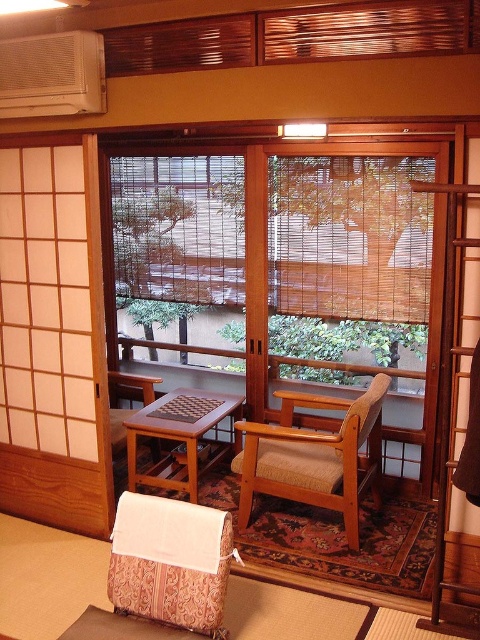
Question: Can you confirm if white plastic air conditioner at upper left is bigger than woodenobject at center?

Choices:
 (A) no
 (B) yes

Answer: (A)

Question: Does wooden woven armchair at center have a larger size compared to white plastic air conditioner at upper left?

Choices:
 (A) no
 (B) yes

Answer: (B)

Question: Which point is closer to the camera?

Choices:
 (A) white plastic air conditioner at upper left
 (B) wooden armchair at left
 (C) woodenobject at center
 (D) wooden woven armchair at center

Answer: (A)

Question: Which object appears farthest from the camera in this image?

Choices:
 (A) wooden armchair at left
 (B) white plastic air conditioner at upper left
 (C) woodenobject at center
 (D) wooden woven armchair at center

Answer: (A)

Question: Among these points, which one is farthest from the camera?

Choices:
 (A) (90, 36)
 (B) (193, 460)
 (C) (364, 417)
 (D) (131, 406)

Answer: (D)

Question: Does wooden woven armchair at center have a smaller size compared to woodenobject at center?

Choices:
 (A) no
 (B) yes

Answer: (A)